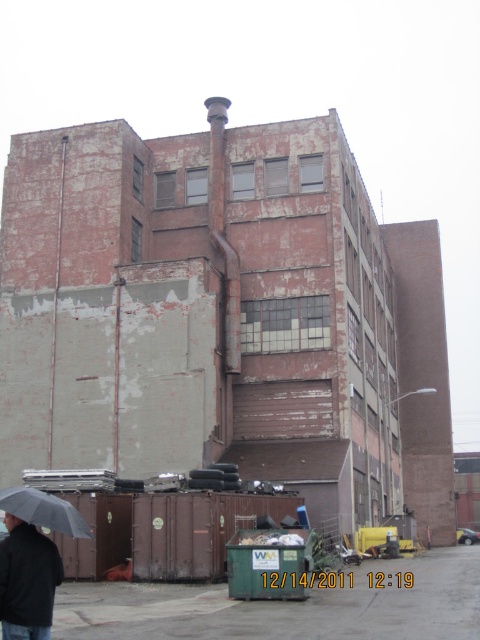
You are a delivery person who needs to locate both the black matte jacket at lower left and the matte black umbrella at lower left. According to the scene, which item is positioned more to the east?

The black matte jacket at lower left is to the right of the matte black umbrella at lower left. Since the scene is viewed from a standard perspective, right corresponds to east, so the black matte jacket at lower left is positioned more to the east.

You are a delivery person who needs to place a new box on top of the black matte jacket at lower left and the matte black umbrella at lower left. Which object should you choose to place the box on so that it is more stable?

The black matte jacket at lower left has a lesser height compared to matte black umbrella at lower left, so placing the box on the taller matte black umbrella at lower left would provide a more stable base due to its height and possibly wider base.

You are standing in front of the industrial building and want to reach the point that is closer to you. Which of the two points, point (10, 554) or point (82, 529), should you head towards?

You should head towards point (10, 554) because it is closer to the viewer than point (82, 529) according to the description.